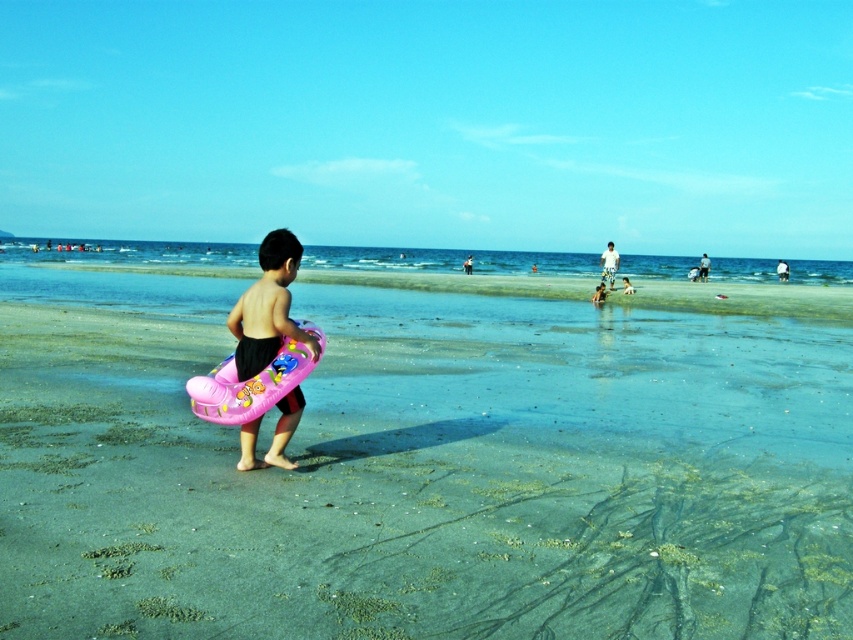
Which is behind, point (492, 488) or point (251, 320)?

Point (492, 488)

Is point (144, 515) positioned after point (283, 285)?

No, (144, 515) is closer to viewer.

Between point (538, 616) and point (293, 413), which one is positioned behind?

The point (293, 413) is behind.

Locate an element on the screen. Image resolution: width=853 pixels, height=640 pixels. pink rubber ring at center is located at coordinates (431, 476).

Does clear blue water at center have a greater height compared to pink inflatable ring at center?

Yes.

Who is taller, clear blue water at center or pink inflatable ring at center?

clear blue water at center is taller.

Who is more forward, (439, 250) or (286, 465)?

Positioned in front is point (286, 465).

The image size is (853, 640). Find the location of `clear blue water at center`. clear blue water at center is located at coordinates (450, 260).

Who is more forward, (492, 467) or (364, 252)?

Point (492, 467) is in front.

Who is positioned more to the left, pink rubber ring at center or clear blue water at center?

pink rubber ring at center

Which is in front, point (405, 397) or point (566, 273)?

Point (405, 397) is more forward.

Where is `pink rubber ring at center`? The image size is (853, 640). pink rubber ring at center is located at coordinates (431, 476).